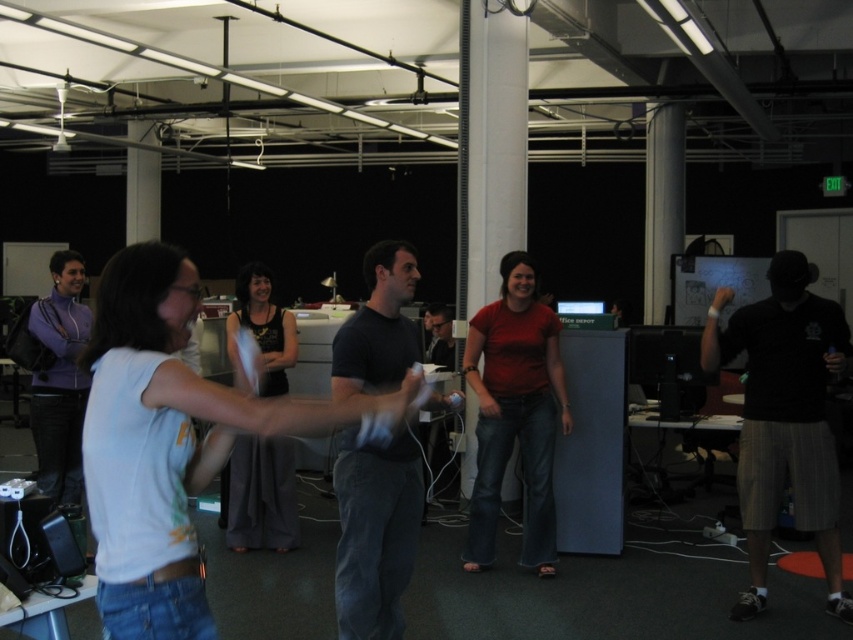
Between black cotton shirt at right and black tank top at center, which one is positioned lower?

black tank top at center is below.

Can you confirm if black cotton shirt at right is positioned below black tank top at center?

Actually, black cotton shirt at right is above black tank top at center.

Which is in front, point (827, 499) or point (281, 481)?

Positioned in front is point (827, 499).

Where is `black cotton shirt at right`? The height and width of the screenshot is (640, 853). black cotton shirt at right is located at coordinates (784, 419).

Which is in front, point (735, 326) or point (498, 332)?

Point (735, 326)

Does black cotton shirt at right appear on the right side of matte red shirt at center?

Indeed, black cotton shirt at right is positioned on the right side of matte red shirt at center.

Is point (775, 321) in front of point (477, 387)?

Yes.

What are the coordinates of `black cotton shirt at right` in the screenshot? It's located at (784, 419).

Is dark gray cotton t-shirt at center positioned in front of purple fleece jacket at left?

Yes, dark gray cotton t-shirt at center is closer to the viewer.

Is point (381, 592) closer to camera compared to point (76, 477)?

Yes, it is.

Where is `dark gray cotton t-shirt at center`? The height and width of the screenshot is (640, 853). dark gray cotton t-shirt at center is located at coordinates (376, 531).

You are a GUI agent. You are given a task and a screenshot of the screen. Output one action in this format:
    pyautogui.click(x=<x>, y=<y>)
    Task: Click on the dark gray cotton t-shirt at center
    
    Given the screenshot: What is the action you would take?
    pyautogui.click(x=376, y=531)